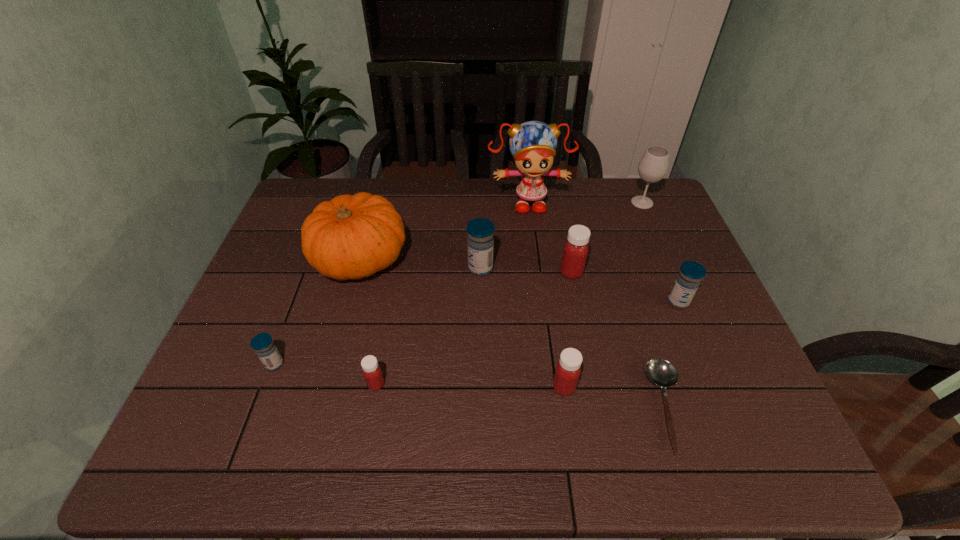
Where is `vacant space at the far right corner`? The height and width of the screenshot is (540, 960). vacant space at the far right corner is located at coordinates (626, 211).

Identify the location of free space between the second red medicine from right to left and the pumpkin. The image size is (960, 540). (462, 323).

At what (x,y) coordinates should I click in order to perform the action: click on vacant space that's between the smallest red medicine and the ladle. Please return your answer as a coordinate pair (x, y). Image resolution: width=960 pixels, height=540 pixels. Looking at the image, I should click on (522, 396).

Identify the location of vacant space that is in between the rightmost blue medicine and the wineglass. (660, 252).

Where is `free space between the shortest object and the biggest red medicine`? free space between the shortest object and the biggest red medicine is located at coordinates (620, 340).

I want to click on free space that is in between the tallest object and the leftmost red medicine, so click(452, 293).

The width and height of the screenshot is (960, 540). I want to click on unoccupied position between the tallest object and the fourth farthest medicine, so click(401, 283).

Where is `free point between the pumpkin and the farthest blue medicine`? This screenshot has height=540, width=960. free point between the pumpkin and the farthest blue medicine is located at coordinates (420, 264).

Identify the location of vacant region between the doll and the second smallest red medicine. The width and height of the screenshot is (960, 540). (546, 295).

This screenshot has width=960, height=540. Find the location of `free space between the wineglass and the smallest blue medicine`. free space between the wineglass and the smallest blue medicine is located at coordinates (458, 284).